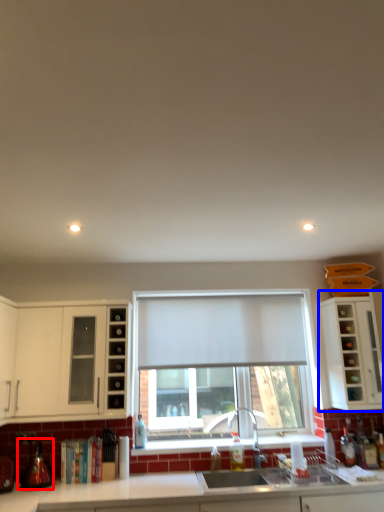
Question: Which of the following is the closest to the observer, appliance (highlighted by a red box) or cabinetry (highlighted by a blue box)?

Choices:
 (A) appliance
 (B) cabinetry

Answer: (A)